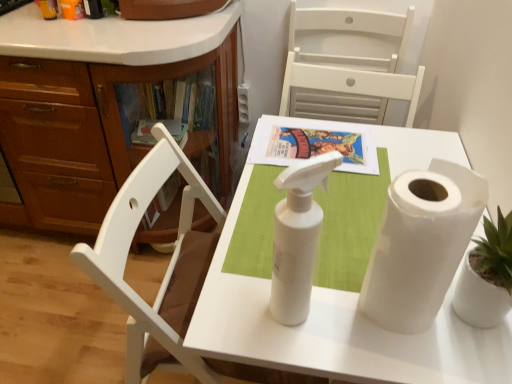
This screenshot has width=512, height=384. I want to click on white matte paper towel roll at center, so click(x=337, y=332).

Image resolution: width=512 pixels, height=384 pixels. Describe the element at coordinates (421, 244) in the screenshot. I see `white paper at right` at that location.

This screenshot has width=512, height=384. Find the location of `white matte paper towel roll at center`. white matte paper towel roll at center is located at coordinates (337, 332).

Could you tell me if white matte chair at upper center is facing white matte spray bottle at center?

Yes, white matte chair at upper center is facing white matte spray bottle at center.

Does white matte chair at upper center have a greater width compared to white matte spray bottle at center?

Incorrect, the width of white matte chair at upper center does not surpass that of white matte spray bottle at center.

Which object is further away from the camera taking this photo, white matte chair at upper center or white matte spray bottle at center?

white matte chair at upper center is more distant.

Is white matte chair at upper center situated inside white matte spray bottle at center or outside?

The correct answer is: outside.

From a real-world perspective, who is located higher, white paper at right or white matte paper towel roll at center?

white paper at right.

Which of these two, white paper at right or white matte paper towel roll at center, is smaller?

With smaller size is white paper at right.

Is white paper at right oriented towards white matte paper towel roll at center?

No, white paper at right is not aimed at white matte paper towel roll at center.

Is white paper at right situated inside white matte paper towel roll at center or outside?

white paper at right is spatially situated outside white matte paper towel roll at center.

You are a GUI agent. You are given a task and a screenshot of the screen. Output one action in this format:
    pyautogui.click(x=<x>, y=<y>)
    Task: Click on the table below the white matte chair at upper center (from a real-world perspective)
    The width and height of the screenshot is (512, 384).
    Given the screenshot: What is the action you would take?
    pyautogui.click(x=337, y=332)

From the image's perspective, is white matte chair at upper center on white matte paper towel roll at center?

Indeed, from the image's perspective, white matte chair at upper center is shown above white matte paper towel roll at center.

Can we say white matte chair at upper center lies outside white matte paper towel roll at center?

Absolutely, white matte chair at upper center is external to white matte paper towel roll at center.

Who is bigger, white matte chair at upper center or white matte paper towel roll at center?

white matte paper towel roll at center.

Can you confirm if white matte paper towel roll at center is bigger than white paper at right?

Correct, white matte paper towel roll at center is larger in size than white paper at right.

How different are the orientations of white matte paper towel roll at center and white paper at right in degrees?

178 degrees.

This screenshot has width=512, height=384. What are the coordinates of `table on the left of white paper at right` in the screenshot? It's located at (337, 332).

From a real-world perspective, which is physically below, white matte paper towel roll at center or white paper at right?

From a 3D spatial view, white matte paper towel roll at center is below.

How many degrees apart are the facing directions of matte paper book at center and white matte paper towel roll at center?

matte paper book at center and white matte paper towel roll at center are facing 178 degrees away from each other.

From a real-world perspective, who is located lower, matte paper book at center or white matte paper towel roll at center?

From a 3D spatial view, white matte paper towel roll at center is below.

Is matte paper book at center looking in the opposite direction of white matte paper towel roll at center?

Correct, matte paper book at center is looking away from white matte paper towel roll at center.

From the image's perspective, which is above, matte paper book at center or white matte paper towel roll at center?

matte paper book at center.

Is white matte spray bottle at center inside or outside of white matte chair at upper center?

white matte spray bottle at center is spatially situated outside white matte chair at upper center.

Is point (270, 304) closer or farther from the camera than point (417, 82)?

Point (270, 304) is closer to the camera than point (417, 82).

Is white matte paper towel roll at center placed right next to white matte spray bottle at center?

white matte paper towel roll at center and white matte spray bottle at center are clearly separated.

From a real-world perspective, is white matte paper towel roll at center positioned under white matte spray bottle at center based on gravity?

Yes, from a real-world perspective, white matte paper towel roll at center is beneath white matte spray bottle at center.

Locate an element on the screen. The image size is (512, 384). soap dispenser on the left of white matte chair at upper center is located at coordinates (297, 237).

At what (x,y) coordinates should I click in order to perform the action: click on table that appears below the white paper at right (from the image's perspective). Please return your answer as a coordinate pair (x, y). Looking at the image, I should click on (337, 332).

Based on their spatial positions, is white matte spray bottle at center or matte paper book at center closer to white matte paper towel roll at center?

white matte spray bottle at center lies closer to white matte paper towel roll at center than the other object.

From the image, which object appears to be nearer to white matte paper towel roll at center, white matte chair at upper center or white paper at right?

Among the two, white paper at right is located nearer to white matte paper towel roll at center.

Which object lies further to the anchor point white matte paper towel roll at center, matte paper book at center or white matte chair at upper center?

white matte chair at upper center.

From the image, which object appears to be nearer to white matte chair at upper center, white matte paper towel roll at center or matte paper book at center?

Based on the image, matte paper book at center appears to be nearer to white matte chair at upper center.

Based on their spatial positions, is white matte paper towel roll at center or white matte chair at upper center closer to matte paper book at center?

Among the two, white matte paper towel roll at center is located nearer to matte paper book at center.

Estimate the real-world distances between objects in this image. Which object is closer to white paper at right, white matte paper towel roll at center or white matte spray bottle at center?

white matte paper towel roll at center is positioned closer to the anchor white paper at right.

Which object lies further to the anchor point matte paper book at center, white matte spray bottle at center or white matte chair at upper center?

Among the two, white matte chair at upper center is located further to matte paper book at center.

From the image, which object appears to be farther from matte paper book at center, white paper at right or white matte chair at upper center?

The object further to matte paper book at center is white matte chair at upper center.

In order to click on table positioned between white matte spray bottle at center and white matte chair at upper center from near to far in this screenshot , I will do `click(337, 332)`.

At what (x,y) coordinates should I click in order to perform the action: click on table between white paper at right and matte paper book at center along the z-axis. Please return your answer as a coordinate pair (x, y). Looking at the image, I should click on (337, 332).

Locate an element on the screen. This screenshot has width=512, height=384. table between white matte spray bottle at center and matte paper book at center along the z-axis is located at coordinates (337, 332).

Image resolution: width=512 pixels, height=384 pixels. Find the location of `paper towel positioned between white matte spray bottle at center and white matte chair at upper center from near to far`. paper towel positioned between white matte spray bottle at center and white matte chair at upper center from near to far is located at coordinates (421, 244).